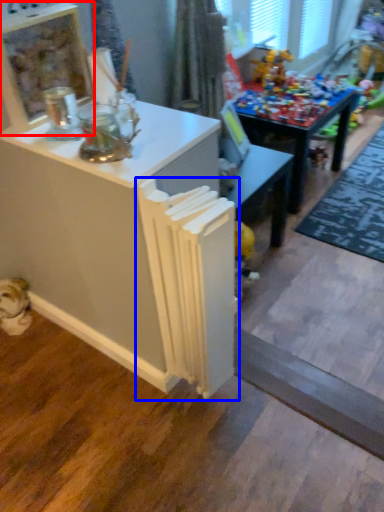
Question: Which object is further to the camera taking this photo, shelf (highlighted by a red box) or radiator (highlighted by a blue box)?

Choices:
 (A) shelf
 (B) radiator

Answer: (A)